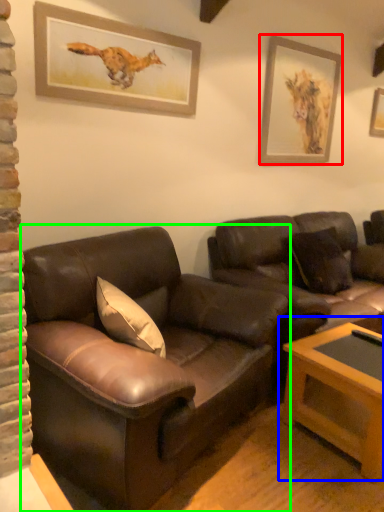
Question: Estimate the real-world distances between objects in this image. Which object is closer to picture frame (highlighted by a red box), table (highlighted by a blue box) or studio couch (highlighted by a green box)?

Choices:
 (A) table
 (B) studio couch

Answer: (A)